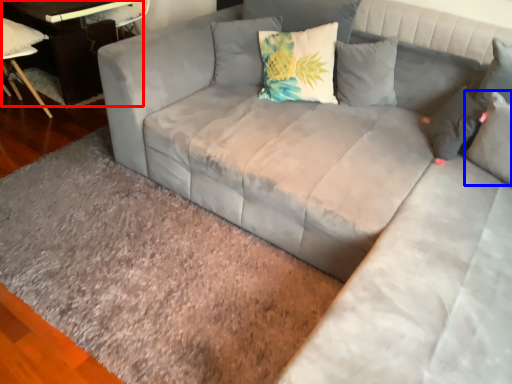
Question: Among these objects, which one is nearest to the camera, table (highlighted by a red box) or pillow (highlighted by a blue box)?

Choices:
 (A) table
 (B) pillow

Answer: (B)